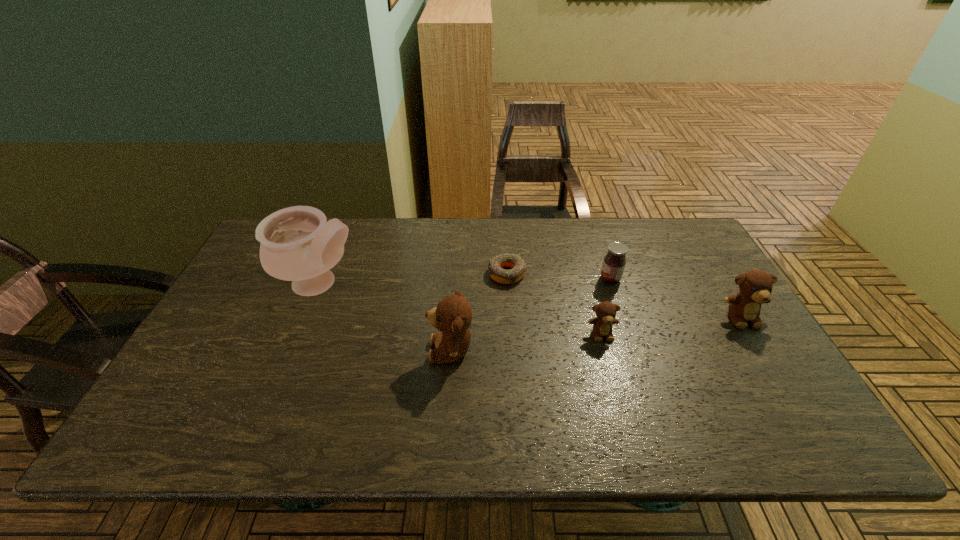
Identify the location of free area in between the doughnut and the jam. (559, 276).

Where is `free space between the second object from left to right and the leftmost object`? The width and height of the screenshot is (960, 540). free space between the second object from left to right and the leftmost object is located at coordinates (386, 318).

Where is `vacant space that's between the shortest object and the jam`? The height and width of the screenshot is (540, 960). vacant space that's between the shortest object and the jam is located at coordinates (559, 276).

At what (x,y) coordinates should I click in order to perform the action: click on vacant space that is in between the jam and the fifth object from right to left. Please return your answer as a coordinate pair (x, y). Image resolution: width=960 pixels, height=540 pixels. Looking at the image, I should click on (531, 314).

The image size is (960, 540). What are the coordinates of `object that is the second nearest to the rightmost object` in the screenshot? It's located at (606, 311).

The image size is (960, 540). I want to click on object identified as the third closest to the third object from left to right, so click(x=614, y=262).

Identify which teddy bear is located as the second nearest to the fourth shortest object. Please provide its 2D coordinates. Your answer should be formatted as a tuple, i.e. [(x, y)], where the tuple contains the x and y coordinates of a point satisfying the conditions above.

[(452, 317)]

Identify the location of teddy bear that is the third closest to the jam. (452, 317).

Find the location of a particular element. The height and width of the screenshot is (540, 960). vacant space that satisfies the following two spatial constraints: 1. on the back side of the fourth object from right to left; 2. on the right side of the pottery is located at coordinates (324, 274).